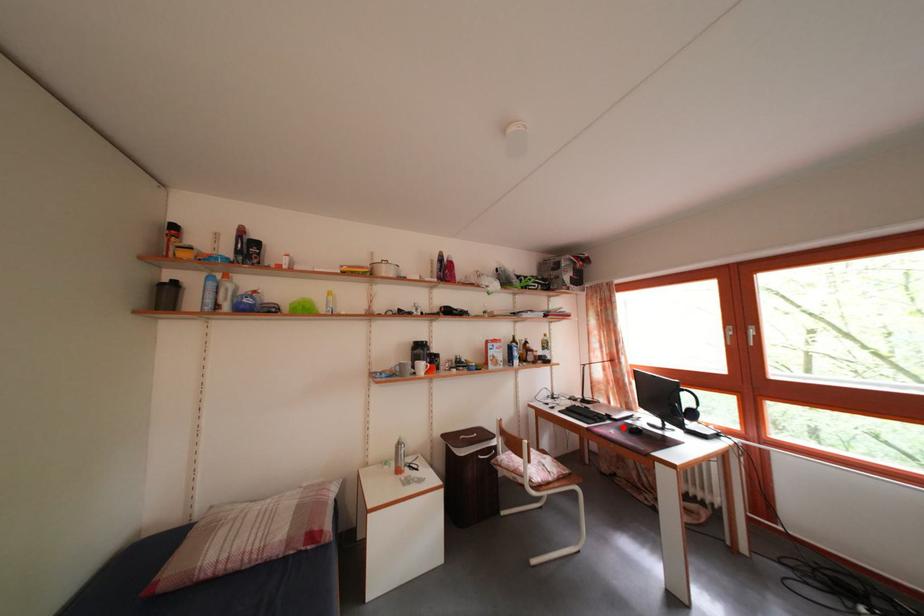
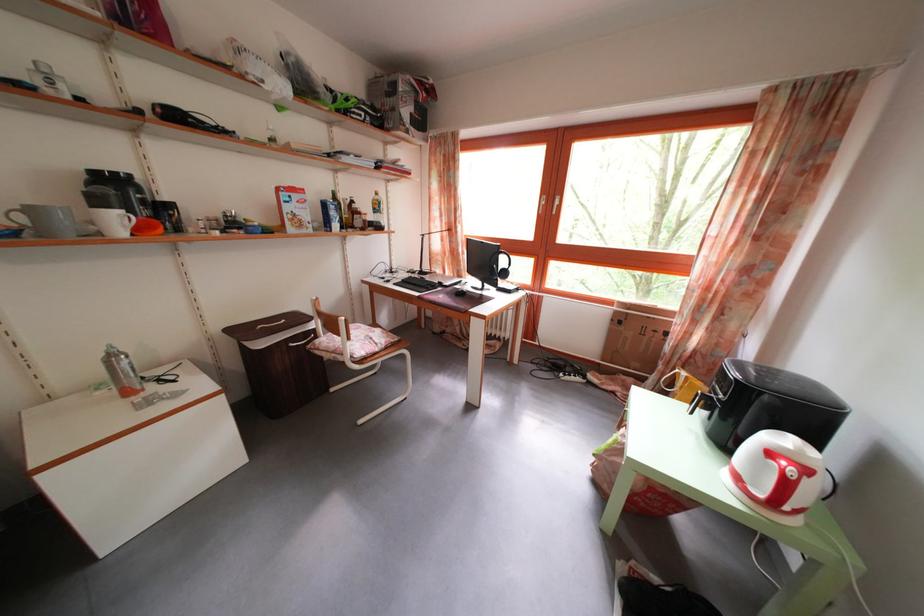
Locate, in the second image, the point that corresponds to the highlighted location in the first image.

(454, 294)